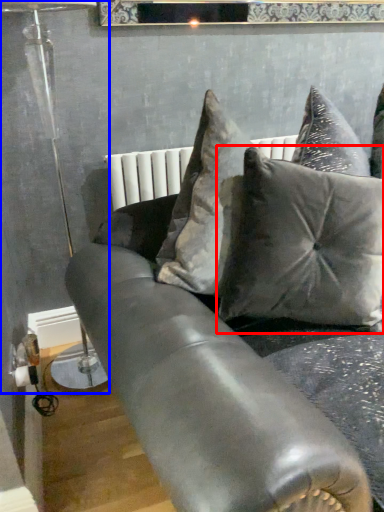
Question: Which object appears farthest to the camera in this image, pillow (highlighted by a red box) or lamp (highlighted by a blue box)?

Choices:
 (A) pillow
 (B) lamp

Answer: (B)